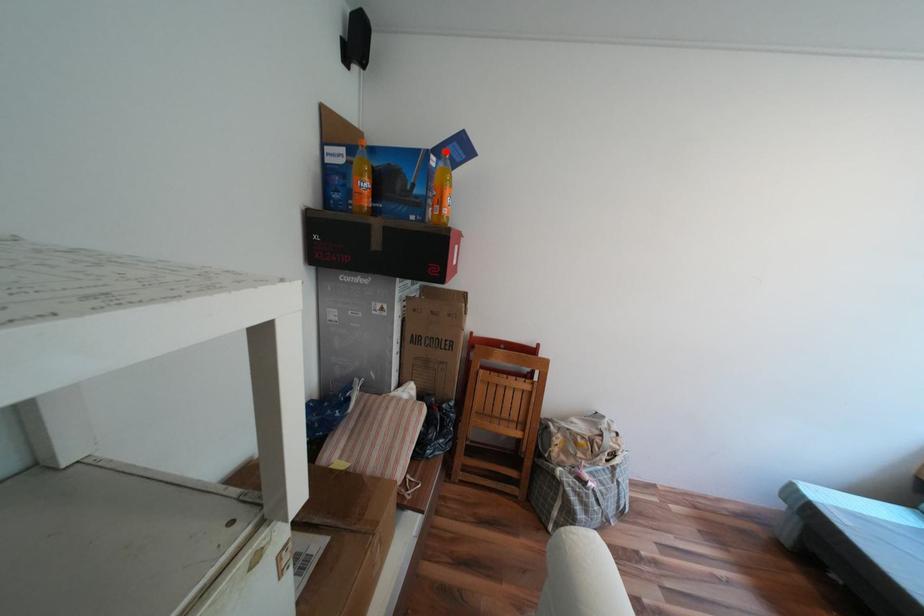
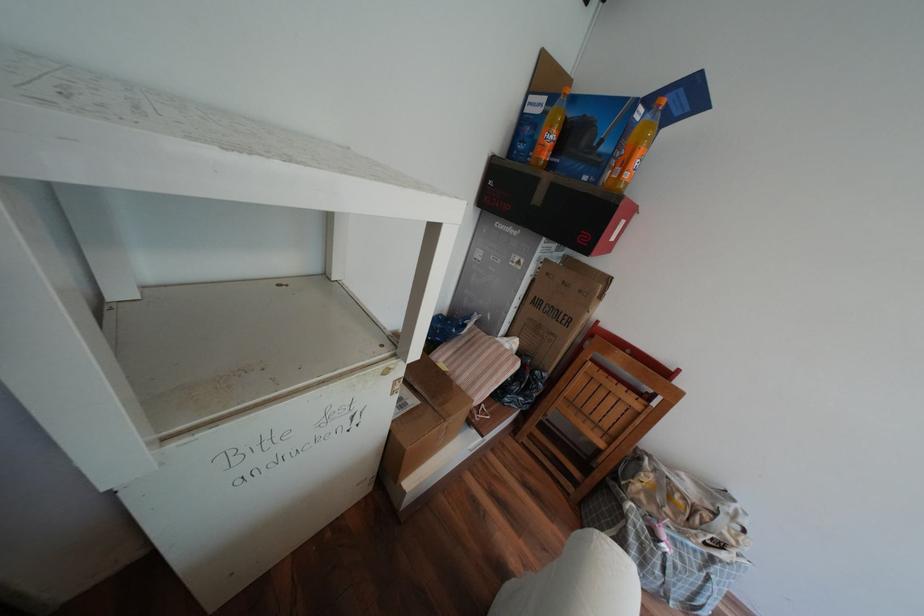
The point at the highlighted location is marked in the first image. Where is the corresponding point in the second image?

(659, 100)